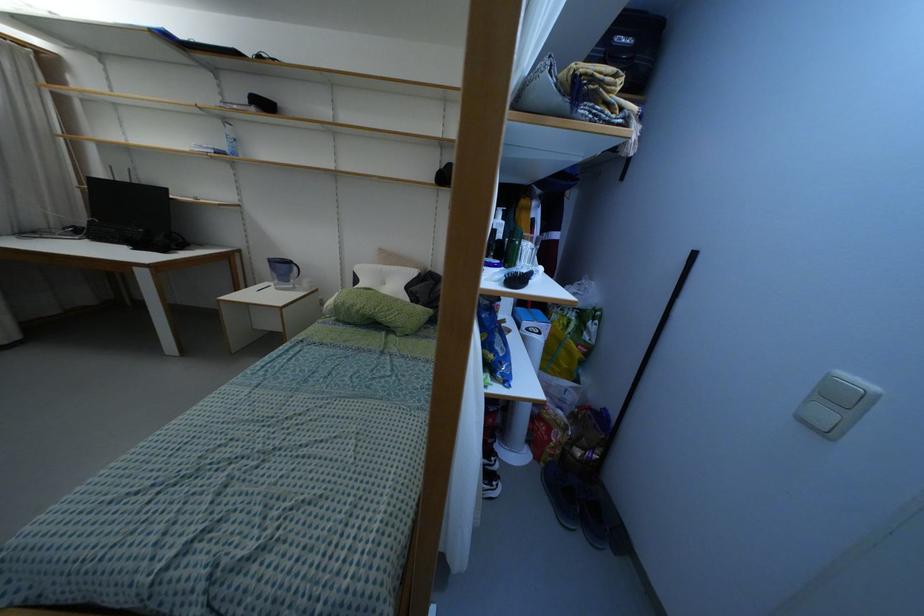
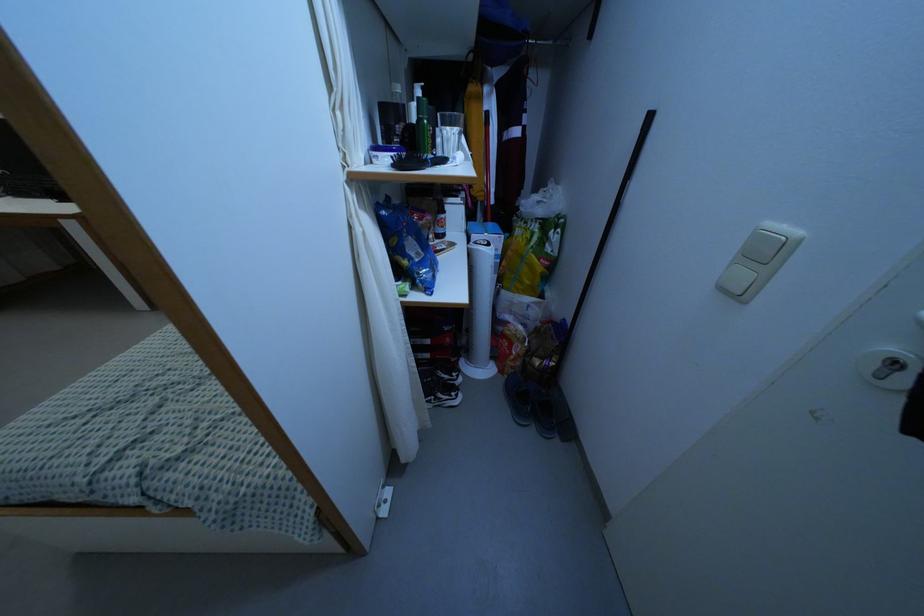
Find the pixel in the second image that matches pixel 843 399 in the first image.

(762, 254)